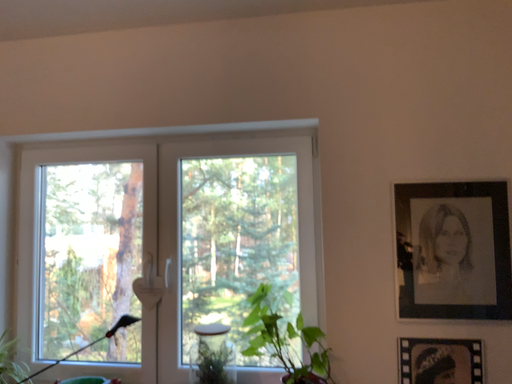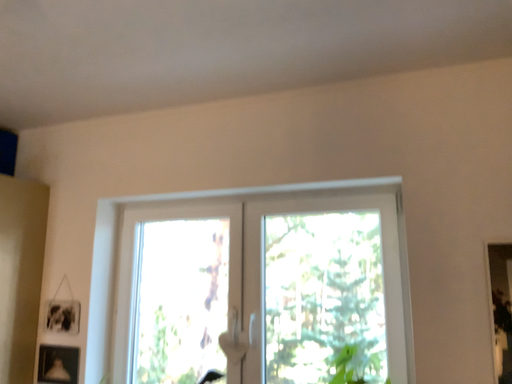
Question: Which way did the camera rotate in the video?

Choices:
 (A) rotated right
 (B) rotated left

Answer: (B)